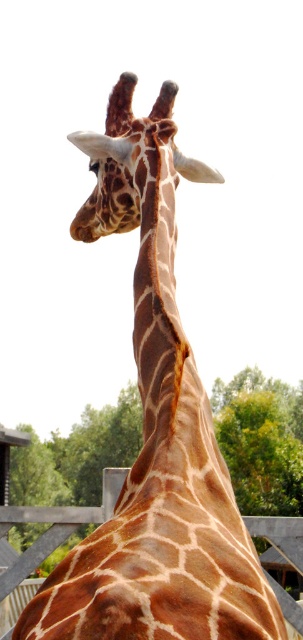
Does brown textured neck at center have a lesser height compared to brown wooden fence at lower center?

No.

Locate an element on the screen. Image resolution: width=303 pixels, height=640 pixels. brown textured neck at center is located at coordinates (163, 333).

Where is `brown textured neck at center`? Image resolution: width=303 pixels, height=640 pixels. brown textured neck at center is located at coordinates (163, 333).

This screenshot has width=303, height=640. In order to click on brown textured neck at center in this screenshot , I will do `click(163, 333)`.

This screenshot has width=303, height=640. Find the location of `brown textured neck at center`. brown textured neck at center is located at coordinates (163, 333).

Does spotted fur giraffe head at center have a larger size compared to brown wooden fence at lower center?

Correct, spotted fur giraffe head at center is larger in size than brown wooden fence at lower center.

Is spotted fur giraffe head at center shorter than brown wooden fence at lower center?

Incorrect, spotted fur giraffe head at center's height does not fall short of brown wooden fence at lower center's.

Where is `spotted fur giraffe head at center`? This screenshot has height=640, width=303. spotted fur giraffe head at center is located at coordinates (126, 161).

Locate an element on the screen. This screenshot has height=640, width=303. spotted fur giraffe head at center is located at coordinates (126, 161).